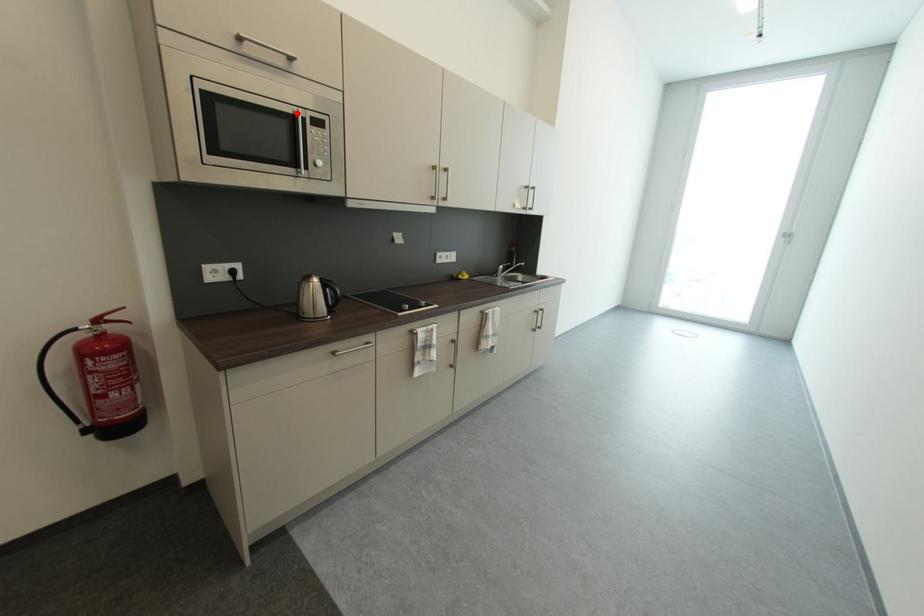
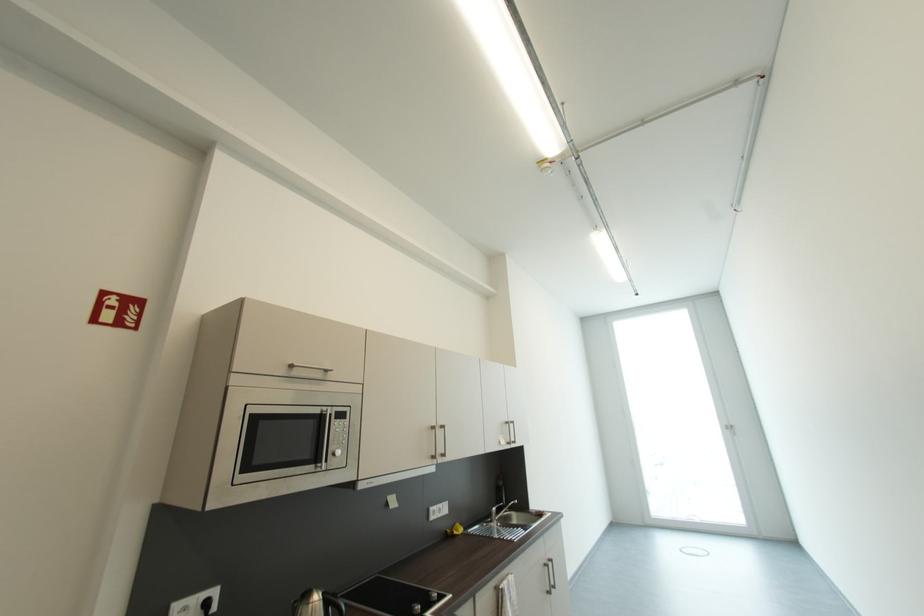
In the second image, find the point that corresponds to the highlighted location in the first image.

(325, 413)